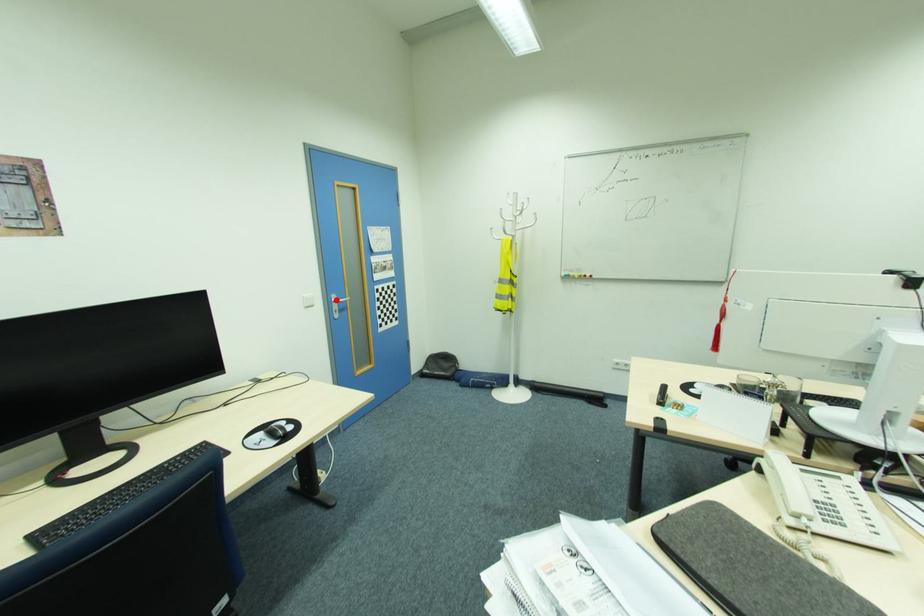
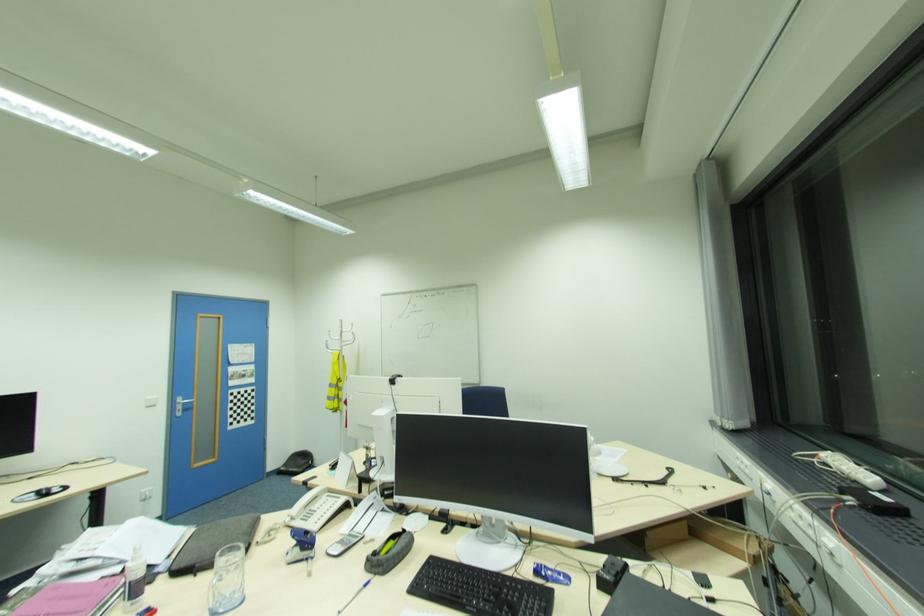
The point at the highlighted location is marked in the first image. Where is the corresponding point in the second image?

(180, 400)